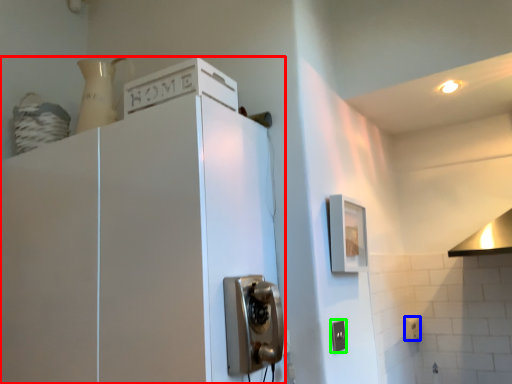
Question: Considering the real-world distances, which object is closest to cabinetry (highlighted by a red box)? electric outlet (highlighted by a blue box) or electric outlet (highlighted by a green box).

Choices:
 (A) electric outlet
 (B) electric outlet

Answer: (B)